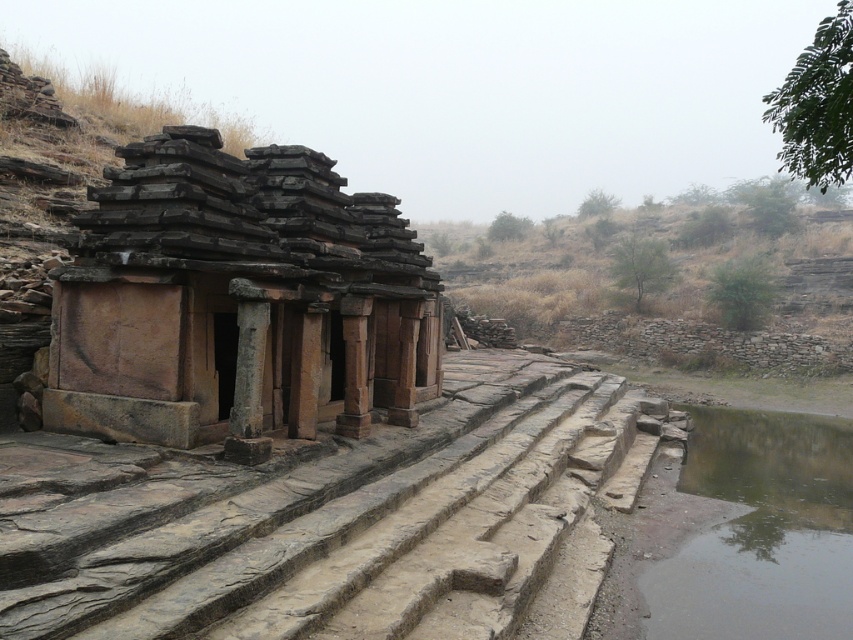
Question: Which object appears closest to the camera in this image?

Choices:
 (A) greenish murky water at bottom right
 (B) rustic stone ruins at center

Answer: (A)

Question: Can you confirm if rustic stone stairs at center is smaller than greenish murky water at bottom right?

Choices:
 (A) no
 (B) yes

Answer: (A)

Question: Which point is closer to the camera taking this photo?

Choices:
 (A) (352, 243)
 (B) (479, 358)
 (C) (784, 486)

Answer: (A)

Question: Does rustic stone stairs at center have a smaller size compared to greenish murky water at bottom right?

Choices:
 (A) yes
 (B) no

Answer: (B)

Question: Can you confirm if rustic stone stairs at center is positioned above greenish murky water at bottom right?

Choices:
 (A) no
 (B) yes

Answer: (B)

Question: Which point appears farthest from the camera in this image?

Choices:
 (A) (689, 456)
 (B) (335, 465)
 (C) (244, 257)

Answer: (A)